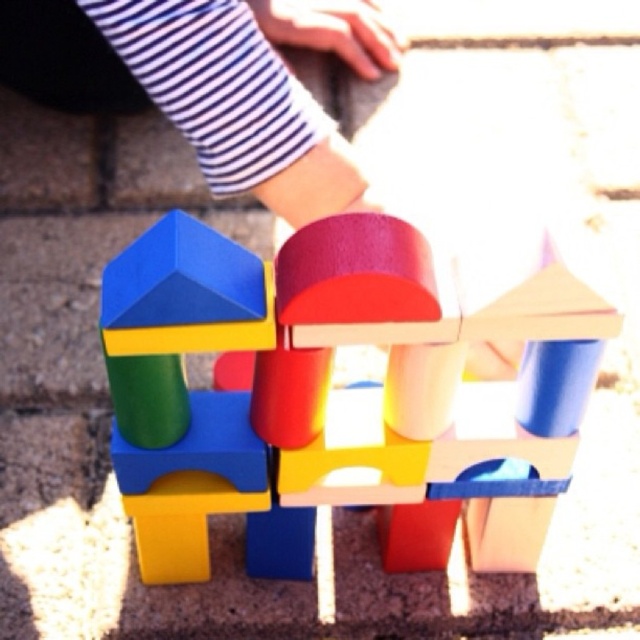
Question: Which object is closer to the camera taking this photo?

Choices:
 (A) wooden blocks at center
 (B) striped fabric at upper center

Answer: (A)

Question: Is wooden blocks at center wider than striped fabric at upper center?

Choices:
 (A) yes
 (B) no

Answer: (A)

Question: Among these points, which one is farthest from the camera?

Choices:
 (A) (248, 449)
 (B) (221, 152)

Answer: (B)

Question: Can you confirm if wooden blocks at center is positioned to the right of striped fabric at upper center?

Choices:
 (A) yes
 (B) no

Answer: (A)

Question: Observing the image, what is the correct spatial positioning of wooden blocks at center in reference to striped fabric at upper center?

Choices:
 (A) above
 (B) below

Answer: (B)